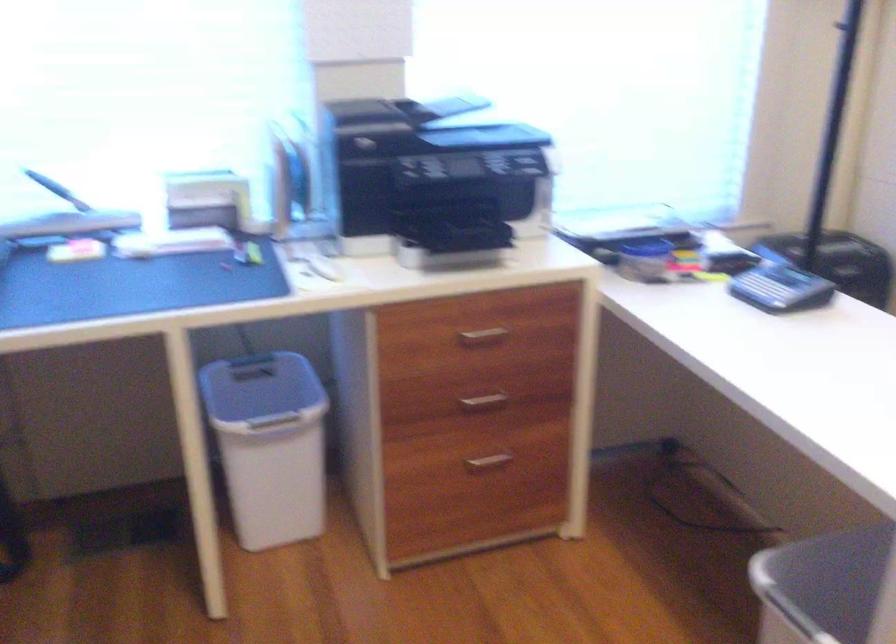
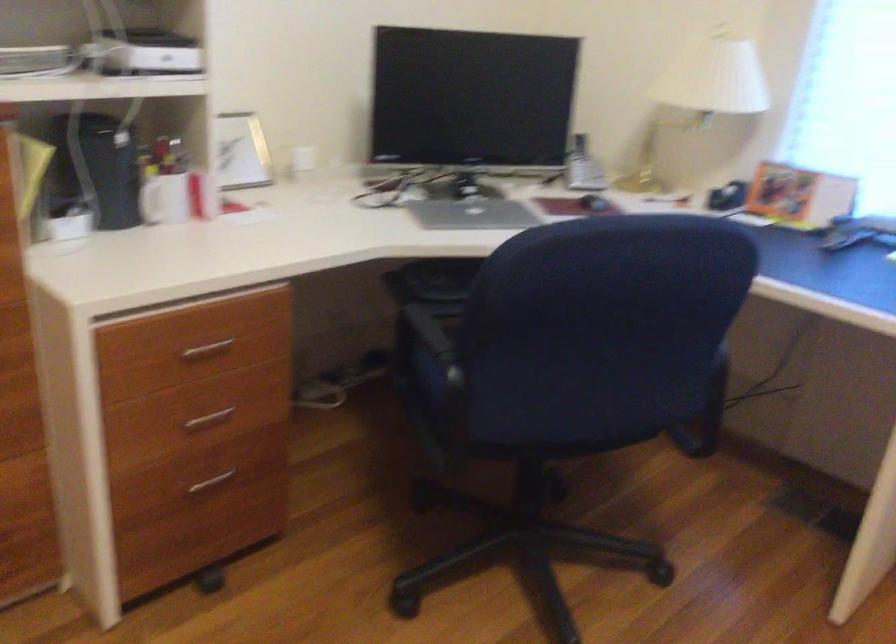
Question: The camera is either moving clockwise (left) or counter-clockwise (right) around the object. The first image is from the beginning of the video and the second image is from the end. Is the camera moving left or right when shooting the video?

Choices:
 (A) Left
 (B) Right

Answer: (B)